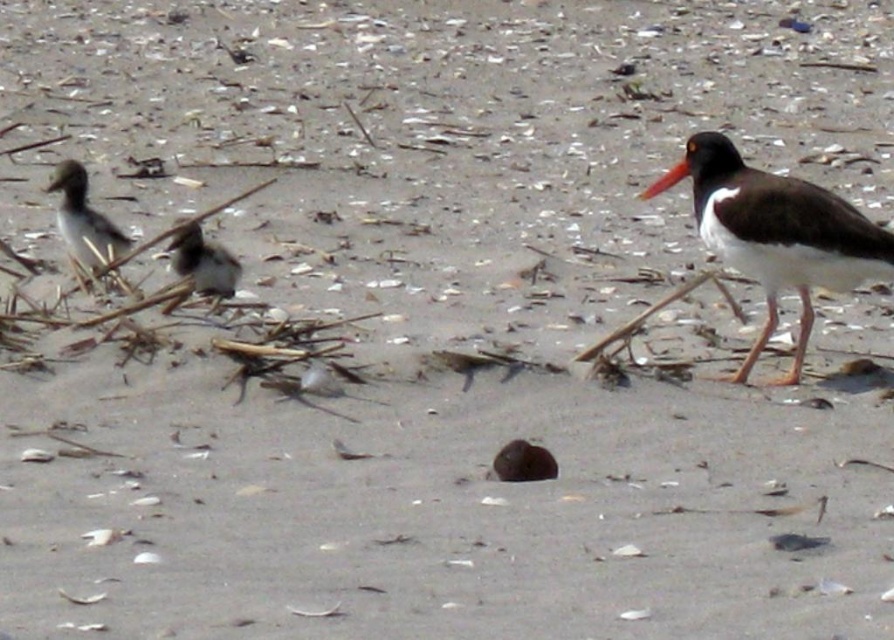
Question: Can you confirm if brown feathered bird at right is positioned below orange beak at right?

Choices:
 (A) yes
 (B) no

Answer: (A)

Question: Is brown feathered bird at right to the right of brown speckled feathers at center from the viewer's perspective?

Choices:
 (A) yes
 (B) no

Answer: (A)

Question: Which of the following is the farthest from the observer?

Choices:
 (A) (212, 266)
 (B) (646, 196)
 (C) (808, 250)

Answer: (A)

Question: Which object is closer to the camera taking this photo?

Choices:
 (A) orange beak at right
 (B) brown feathered bird at right

Answer: (B)

Question: Considering the real-world distances, which object is farthest from the brown feathered bird at left?

Choices:
 (A) brown speckled feathers at center
 (B) orange beak at right

Answer: (B)

Question: Can you confirm if brown feathered bird at right is thinner than brown feathered bird at left?

Choices:
 (A) no
 (B) yes

Answer: (A)